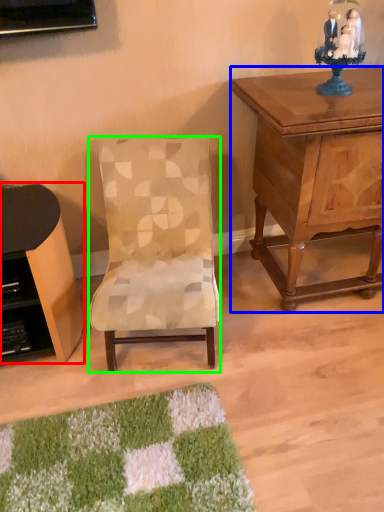
Question: Considering the real-world distances, which object is closest to desk (highlighted by a red box)? nightstand (highlighted by a blue box) or chair (highlighted by a green box).

Choices:
 (A) nightstand
 (B) chair

Answer: (B)